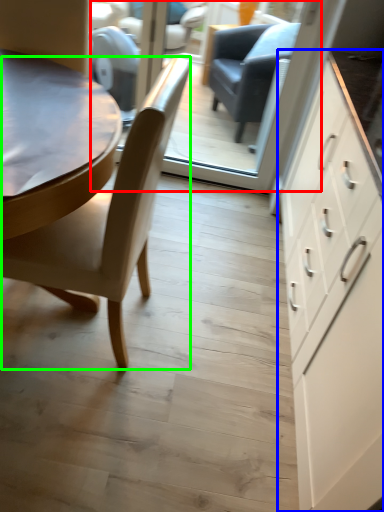
Question: Which object is the farthest from glass door (highlighted by a red box)? Choose among these: cabinetry (highlighted by a blue box) or chair (highlighted by a green box).

Choices:
 (A) cabinetry
 (B) chair

Answer: (B)